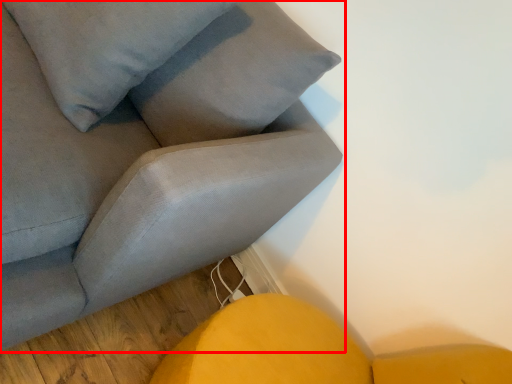
Question: From the image's perspective, what is the correct spatial relationship of studio couch (annotated by the red box) in relation to pillow?

Choices:
 (A) below
 (B) above

Answer: (A)